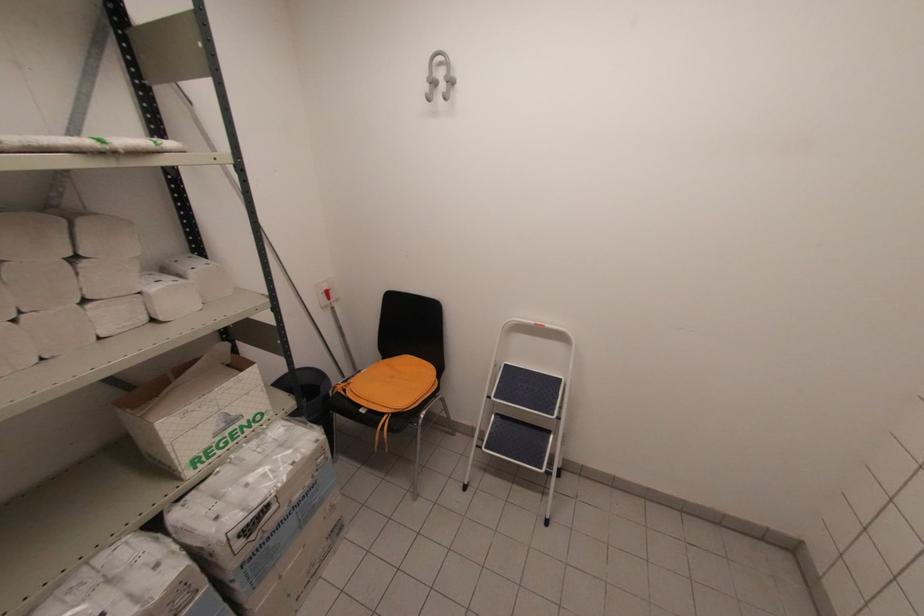
The height and width of the screenshot is (616, 924). Describe the element at coordinates (283, 531) in the screenshot. I see `the sealed cardboard box` at that location.